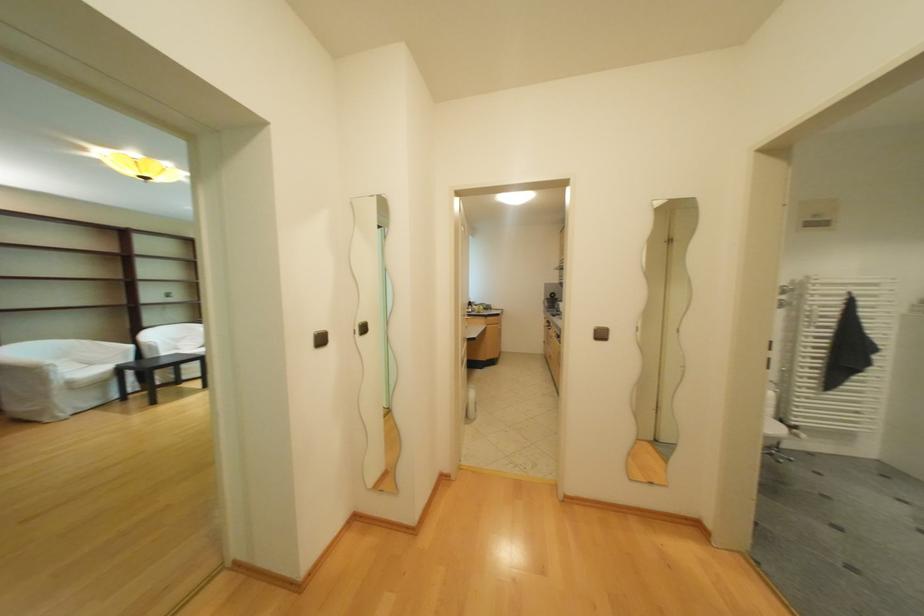
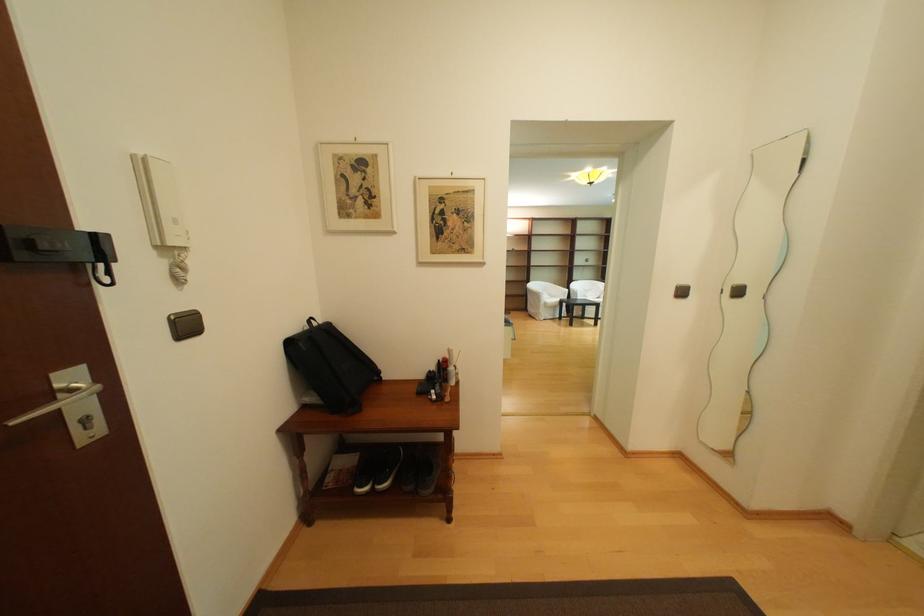
Question: The images are taken continuously from a first-person perspective. In which direction is your viewpoint rotating?

Choices:
 (A) Left
 (B) Right
 (C) Up
 (D) Down

Answer: (A)